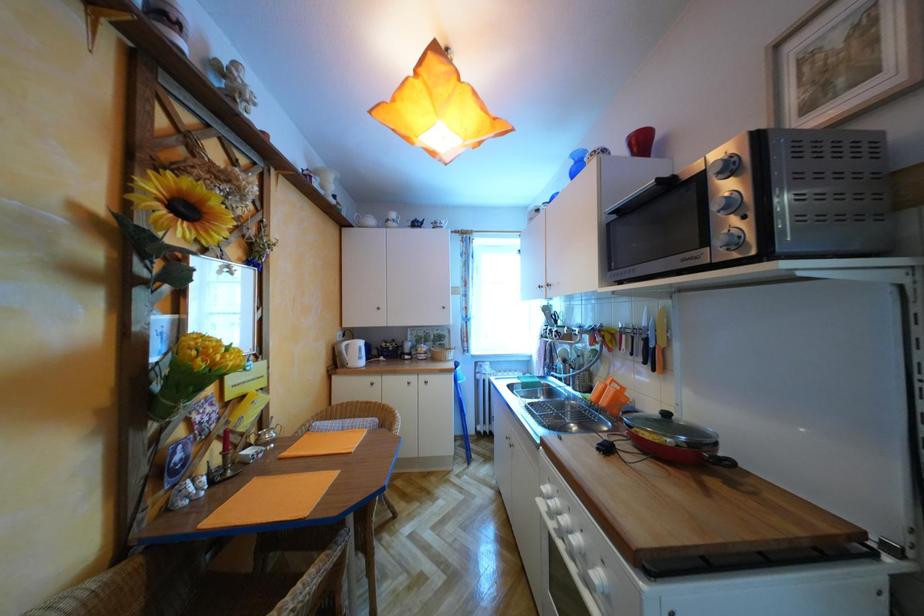
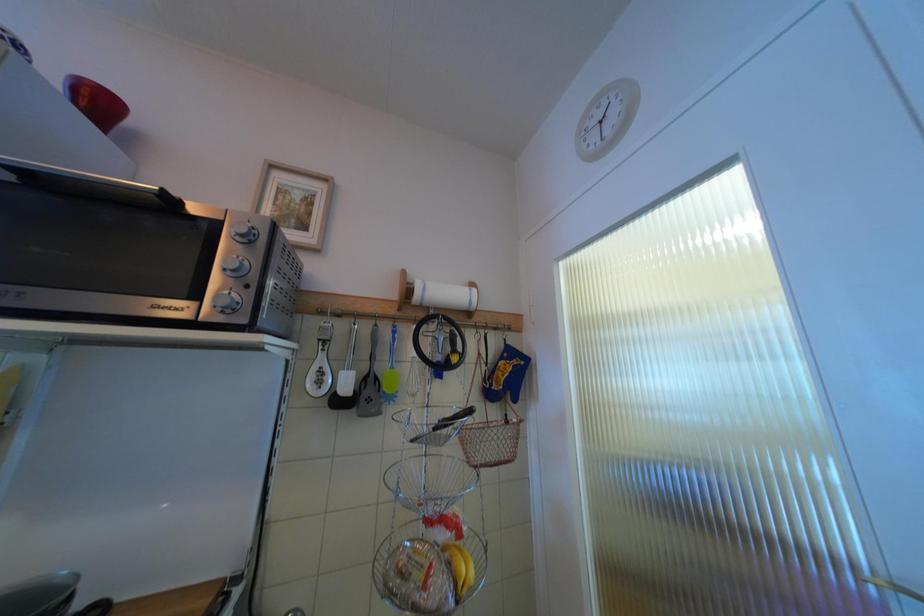
The first image is from the beginning of the video and the second image is from the end. How did the camera likely rotate when shooting the video?

The rotation direction of the camera is right-up.